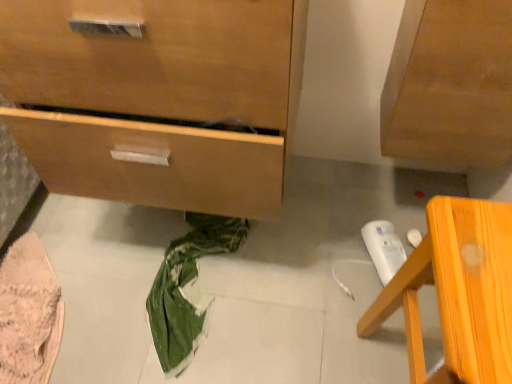
Question: Is orange wood chair at lower right closer to camera compared to wooden chest of drawers at lower left?

Choices:
 (A) no
 (B) yes

Answer: (B)

Question: From the image's perspective, is orange wood chair at lower right on top of wooden chest of drawers at lower left?

Choices:
 (A) yes
 (B) no

Answer: (B)

Question: Does orange wood chair at lower right have a smaller size compared to wooden chest of drawers at lower left?

Choices:
 (A) yes
 (B) no

Answer: (A)

Question: Does orange wood chair at lower right appear on the left side of wooden chest of drawers at lower left?

Choices:
 (A) no
 (B) yes

Answer: (A)

Question: Is orange wood chair at lower right at the right side of wooden chest of drawers at lower left?

Choices:
 (A) no
 (B) yes

Answer: (B)

Question: In terms of width, does orange wood chair at lower right look wider or thinner when compared to pink knitted fabric at lower left?

Choices:
 (A) thin
 (B) wide

Answer: (A)

Question: From a real-world perspective, is orange wood chair at lower right positioned above or below pink knitted fabric at lower left?

Choices:
 (A) above
 (B) below

Answer: (A)

Question: From their relative heights in the image, would you say orange wood chair at lower right is taller or shorter than pink knitted fabric at lower left?

Choices:
 (A) short
 (B) tall

Answer: (B)

Question: Is orange wood chair at lower right bigger or smaller than pink knitted fabric at lower left?

Choices:
 (A) small
 (B) big

Answer: (B)

Question: In terms of size, does orange wood chair at lower right appear bigger or smaller than wooden chest of drawers at lower left?

Choices:
 (A) big
 (B) small

Answer: (B)

Question: Is orange wood chair at lower right wider or thinner than wooden chest of drawers at lower left?

Choices:
 (A) wide
 (B) thin

Answer: (B)

Question: Is orange wood chair at lower right taller or shorter than wooden chest of drawers at lower left?

Choices:
 (A) short
 (B) tall

Answer: (A)

Question: From a real-world perspective, is orange wood chair at lower right physically located above or below wooden chest of drawers at lower left?

Choices:
 (A) below
 (B) above

Answer: (A)

Question: Is wooden chest of drawers at lower left taller or shorter than orange wood chair at lower right?

Choices:
 (A) short
 (B) tall

Answer: (B)

Question: Considering the positions of wooden chest of drawers at lower left and orange wood chair at lower right in the image, is wooden chest of drawers at lower left bigger or smaller than orange wood chair at lower right?

Choices:
 (A) big
 (B) small

Answer: (A)